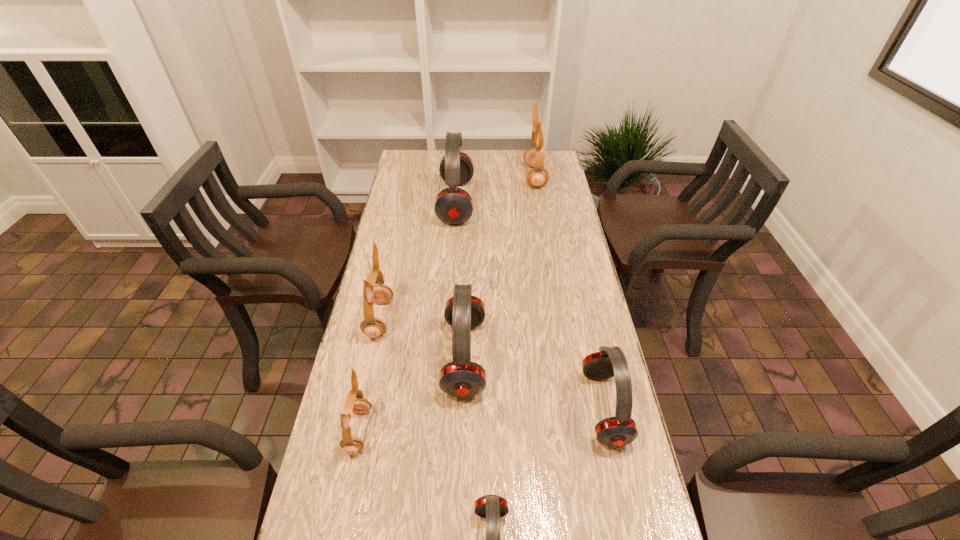
This screenshot has width=960, height=540. I want to click on free space located on the ear cups of the biggest red earphone, so click(563, 202).

Where is `vacant space located on the ear cups of the third smallest red earphone`? vacant space located on the ear cups of the third smallest red earphone is located at coordinates (564, 357).

I want to click on vacant position located 0.080m on the front-facing side of the second biggest brown earphone, so click(418, 319).

This screenshot has width=960, height=540. In order to click on vacant space situated 0.260m on the ear cups of the rightmost red earphone in this screenshot , I will do `click(484, 408)`.

Locate an element on the screen. The image size is (960, 540). vacant space located 0.190m on the ear cups of the rightmost red earphone is located at coordinates (512, 408).

This screenshot has height=540, width=960. I want to click on free point located on the ear cups of the rightmost red earphone, so click(x=504, y=408).

The width and height of the screenshot is (960, 540). Identify the location of vacant space positioned on the front-facing side of the nearest brown earphone. (431, 430).

This screenshot has width=960, height=540. What are the coordinates of `object that is at the far edge` in the screenshot? It's located at (537, 177).

Identify the location of object at the far right corner. Image resolution: width=960 pixels, height=540 pixels. (537, 177).

Locate an element on the screen. The width and height of the screenshot is (960, 540). vacant space at the far edge of the desktop is located at coordinates (503, 176).